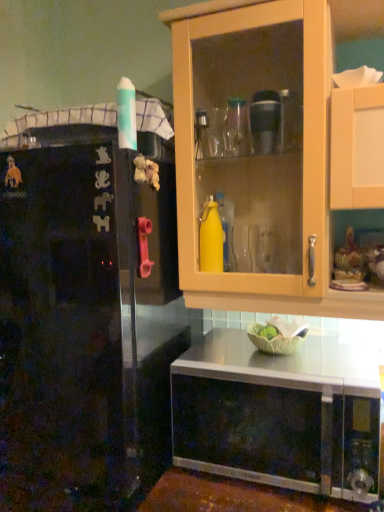
Question: Does stainless steel microwave at lower center have a larger size compared to black matte refrigerator at left?

Choices:
 (A) no
 (B) yes

Answer: (A)

Question: Is stainless steel microwave at lower center far away from black matte refrigerator at left?

Choices:
 (A) yes
 (B) no

Answer: (B)

Question: Is black matte refrigerator at left at the back of stainless steel microwave at lower center?

Choices:
 (A) no
 (B) yes

Answer: (A)

Question: Does stainless steel microwave at lower center have a lesser height compared to black matte refrigerator at left?

Choices:
 (A) yes
 (B) no

Answer: (A)

Question: Considering the relative sizes of stainless steel microwave at lower center and black matte refrigerator at left in the image provided, is stainless steel microwave at lower center wider than black matte refrigerator at left?

Choices:
 (A) no
 (B) yes

Answer: (A)

Question: Does stainless steel microwave at lower center have a greater height compared to black matte refrigerator at left?

Choices:
 (A) yes
 (B) no

Answer: (B)

Question: Does black matte refrigerator at left have a larger size compared to stainless steel microwave at lower center?

Choices:
 (A) no
 (B) yes

Answer: (B)

Question: Considering the relative sizes of black matte refrigerator at left and stainless steel microwave at lower center in the image provided, is black matte refrigerator at left shorter than stainless steel microwave at lower center?

Choices:
 (A) no
 (B) yes

Answer: (A)

Question: Is black matte refrigerator at left turned away from stainless steel microwave at lower center?

Choices:
 (A) yes
 (B) no

Answer: (B)

Question: Considering the relative sizes of black matte refrigerator at left and stainless steel microwave at lower center in the image provided, is black matte refrigerator at left wider than stainless steel microwave at lower center?

Choices:
 (A) yes
 (B) no

Answer: (A)

Question: Is black matte refrigerator at left smaller than stainless steel microwave at lower center?

Choices:
 (A) yes
 (B) no

Answer: (B)

Question: Can you confirm if black matte refrigerator at left is taller than stainless steel microwave at lower center?

Choices:
 (A) yes
 (B) no

Answer: (A)

Question: Is black matte refrigerator at left bigger or smaller than stainless steel microwave at lower center?

Choices:
 (A) big
 (B) small

Answer: (A)